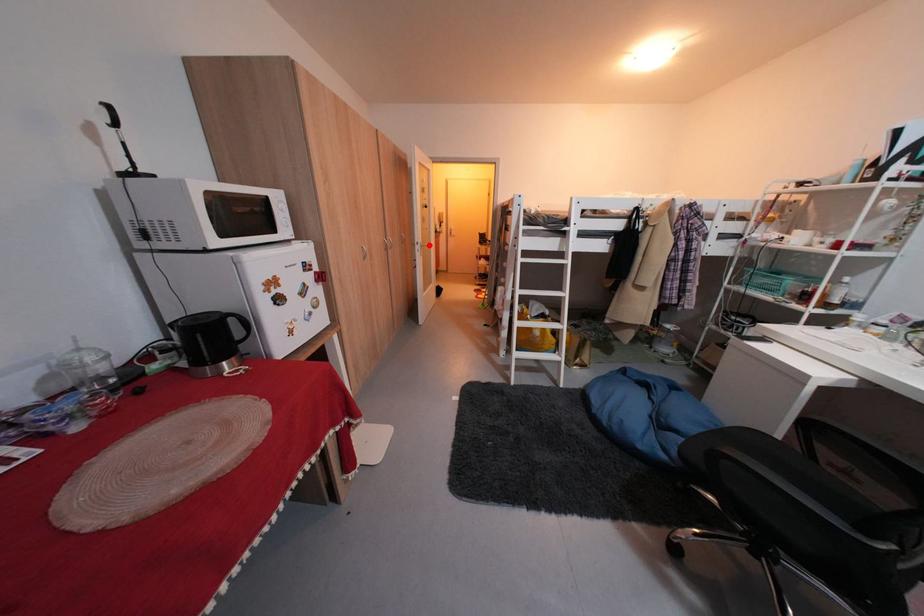
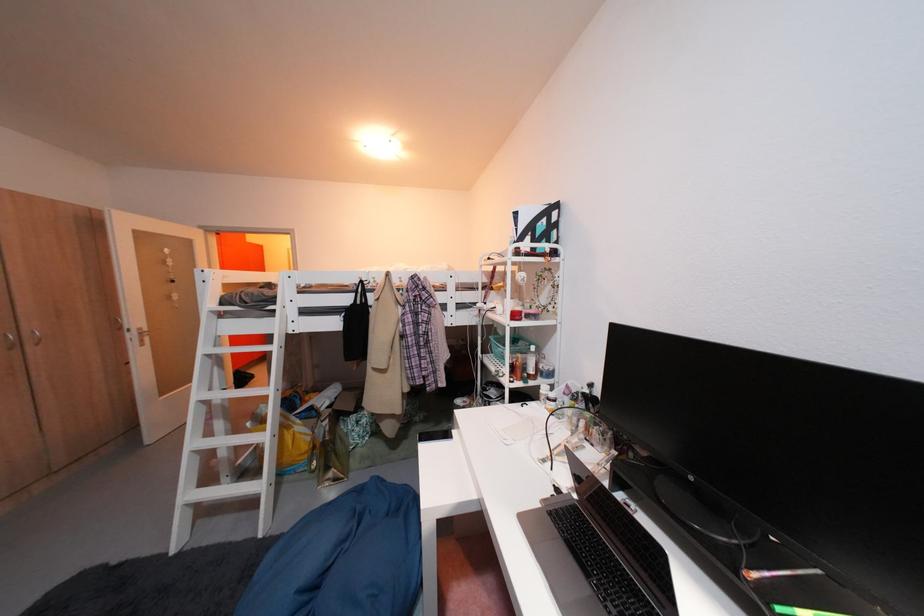
Where in the second image is the point corresponding to the highlighted location from the first image?

(140, 331)